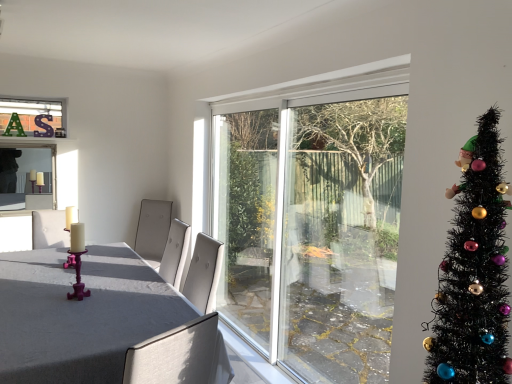
This screenshot has height=384, width=512. I want to click on free space in front of white glossy candle at left, so click(x=57, y=276).